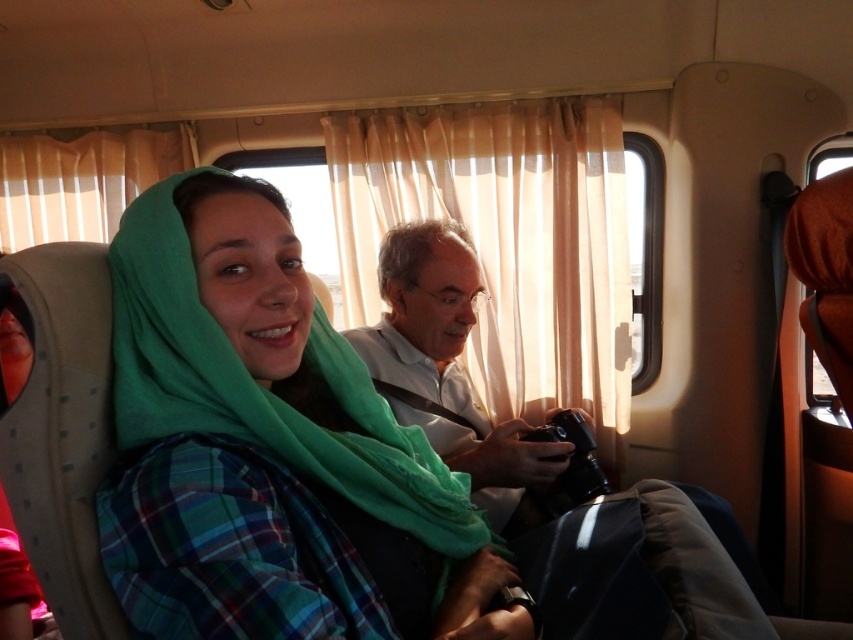
Question: Is green fabric shawl at center below matte black camera at center?

Choices:
 (A) no
 (B) yes

Answer: (A)

Question: From the image, what is the correct spatial relationship of green fabric shawl at center in relation to matte black camera at center?

Choices:
 (A) left
 (B) right

Answer: (A)

Question: Which of the following is the closest to the observer?

Choices:
 (A) (202, 616)
 (B) (564, 529)

Answer: (A)

Question: Where is green fabric shawl at center located in relation to matte black camera at center in the image?

Choices:
 (A) below
 (B) above

Answer: (B)